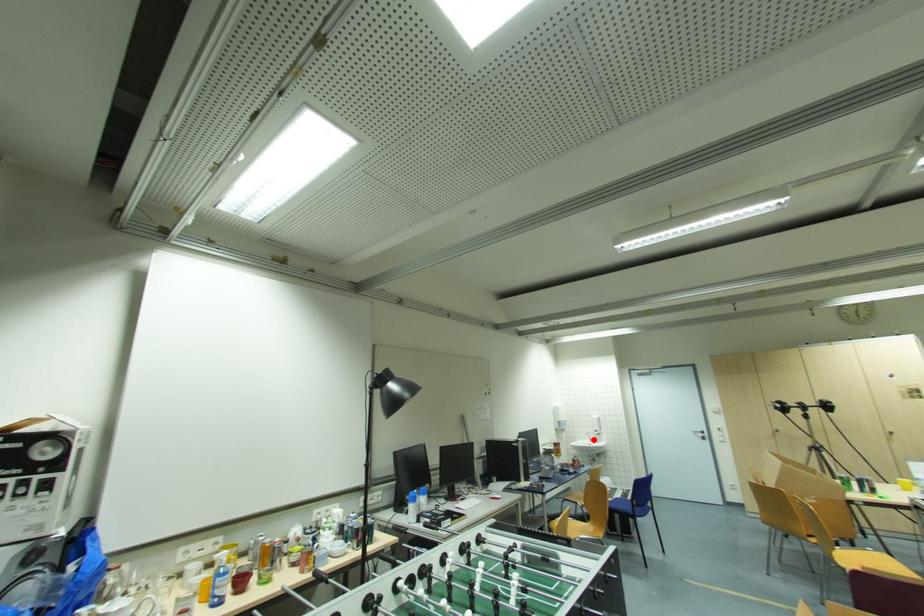
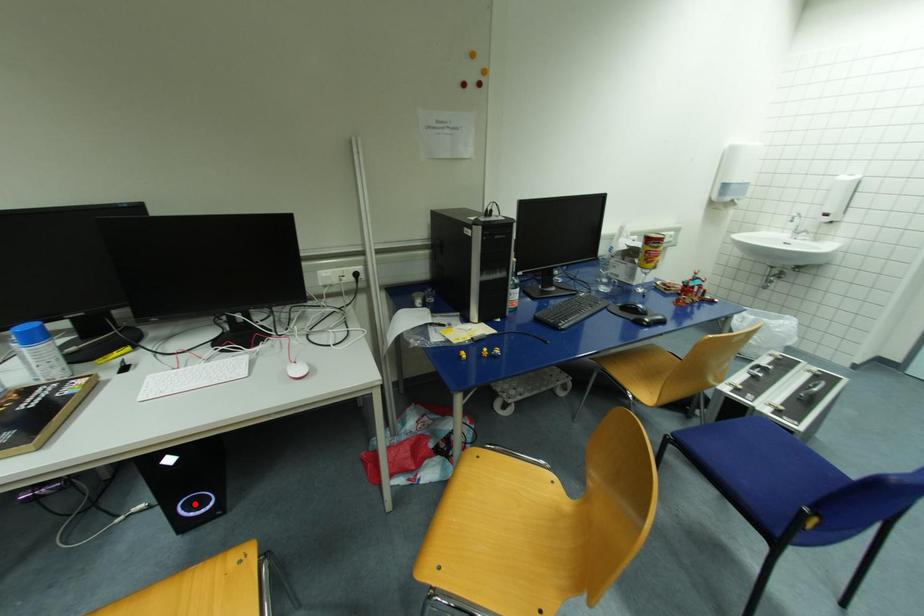
I am providing you with two images of the same scene from different viewpoints. A red point is marked on the first image and another point is marked on the second image. Are the points marked in image1 and image2 representing the same 3D position?

No